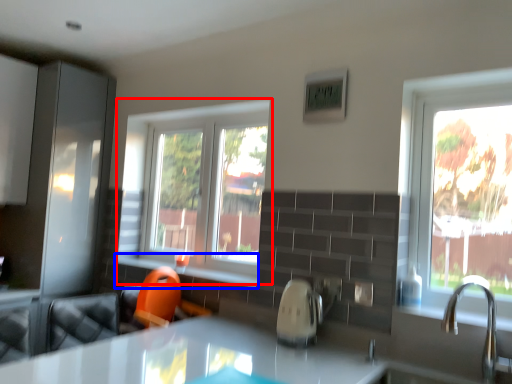
Question: Which point is further to the camera, window (highlighted by a red box) or window sill (highlighted by a blue box)?

Choices:
 (A) window
 (B) window sill

Answer: (A)